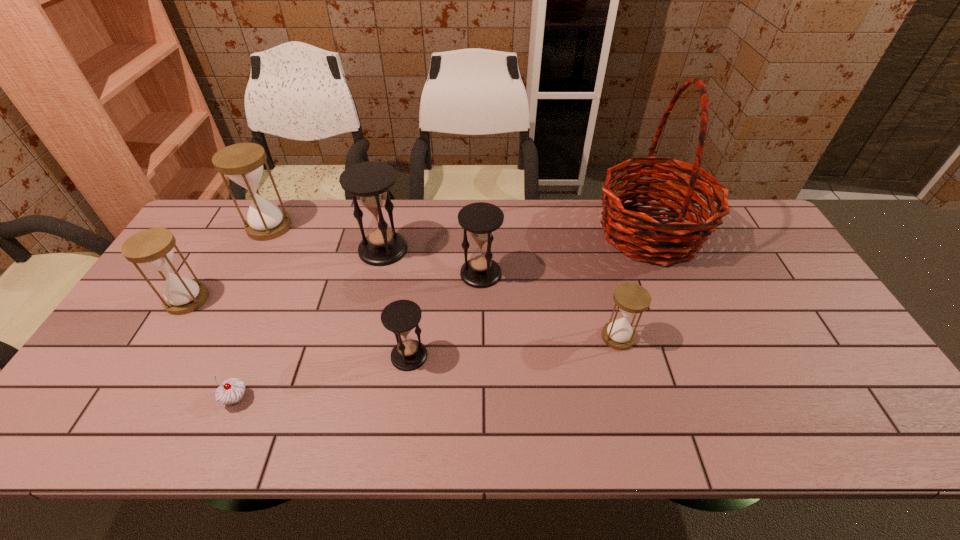
Locate an element on the screen. the fourth object from right to left is located at coordinates (400, 317).

In order to click on the shortest object in this screenshot , I will do `click(231, 391)`.

This screenshot has height=540, width=960. I want to click on the nearest object, so click(x=231, y=391).

Identify the location of blank area located 0.060m on the right of the basket. Image resolution: width=960 pixels, height=540 pixels. (726, 233).

This screenshot has height=540, width=960. What are the coordinates of `vacant region located 0.320m on the right of the leftmost black hourglass` in the screenshot? It's located at (509, 249).

Where is `free spot located 0.210m on the right of the farthest white hourglass`? free spot located 0.210m on the right of the farthest white hourglass is located at coordinates 353,227.

I want to click on free space located 0.380m on the right of the rightmost black hourglass, so click(629, 273).

Find the location of a particular element. The width and height of the screenshot is (960, 540). vacant space located 0.130m on the right of the second nearest white hourglass is located at coordinates (253, 300).

Where is `vacant region located 0.070m on the left of the smallest white hourglass`? The height and width of the screenshot is (540, 960). vacant region located 0.070m on the left of the smallest white hourglass is located at coordinates (575, 337).

I want to click on vacant space located 0.230m on the back of the smallest black hourglass, so click(420, 277).